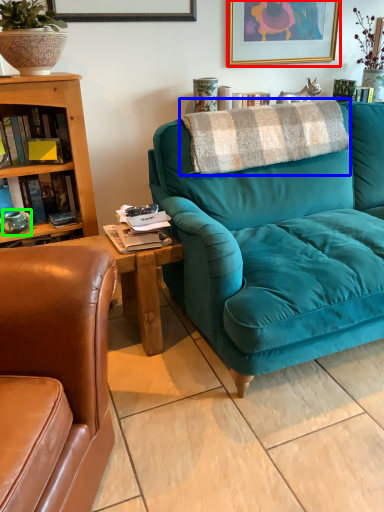
Question: Which object is the farthest from picture frame (highlighted by a red box)? Choose among these: blanket (highlighted by a blue box) or teal (highlighted by a green box).

Choices:
 (A) blanket
 (B) teal

Answer: (B)